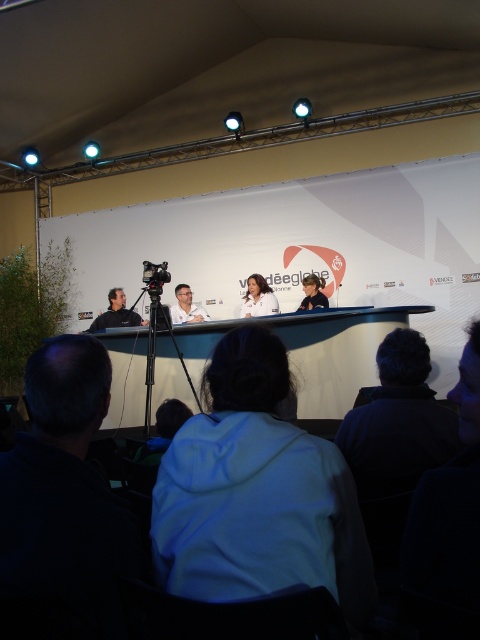
Does white glossy table at center have a greater height compared to matte black jacket at left?

Yes, white glossy table at center is taller than matte black jacket at left.

Who is positioned more to the right, white glossy table at center or matte black jacket at left?

Positioned to the right is white glossy table at center.

Image resolution: width=480 pixels, height=640 pixels. I want to click on white glossy table at center, so click(336, 353).

Is point (101, 538) positioned behind point (369, 358)?

No, it is in front of (369, 358).

Who is taller, dark blue fabric at left or white glossy table at center?

With more height is white glossy table at center.

The width and height of the screenshot is (480, 640). What do you see at coordinates (67, 492) in the screenshot?
I see `dark blue fabric at left` at bounding box center [67, 492].

Find the location of a particular element. This screenshot has height=640, width=480. dark blue fabric at left is located at coordinates (67, 492).

Does white glossy table at center have a greater width compared to white fabric at center?

Yes.

Does white glossy table at center appear on the left side of white fabric at center?

Correct, you'll find white glossy table at center to the left of white fabric at center.

Does point (332, 321) come farther from viewer compared to point (247, 282)?

No, (332, 321) is closer to viewer.

The width and height of the screenshot is (480, 640). In order to click on white glossy table at center in this screenshot , I will do 336,353.